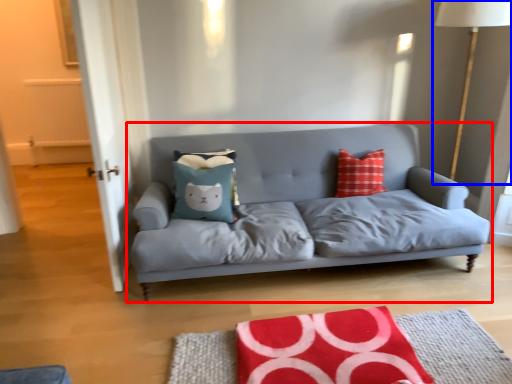
Question: Which point is further to the camera, studio couch (highlighted by a red box) or table lamp (highlighted by a blue box)?

Choices:
 (A) studio couch
 (B) table lamp

Answer: (B)